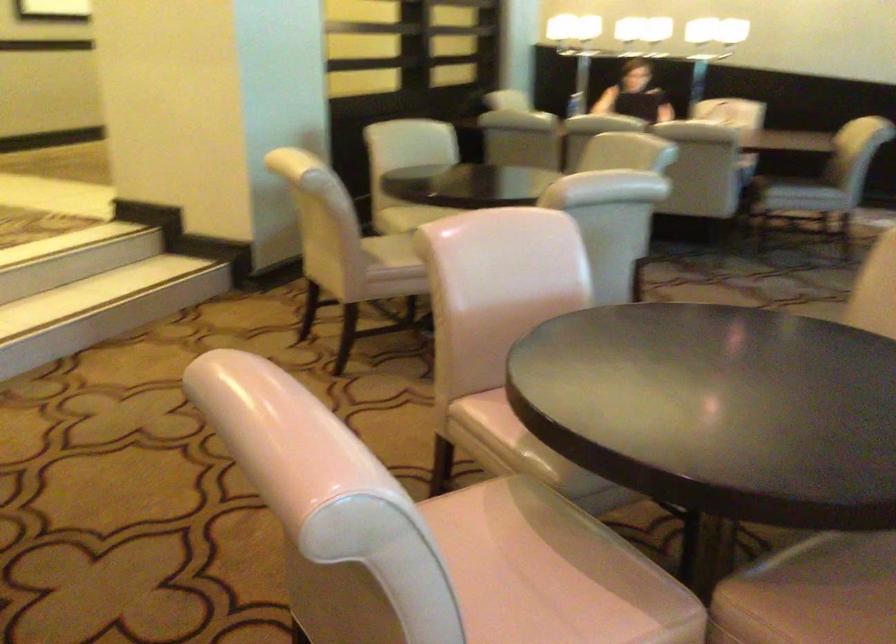
Where is `chair sitting surface`? The width and height of the screenshot is (896, 644). chair sitting surface is located at coordinates (828, 590).